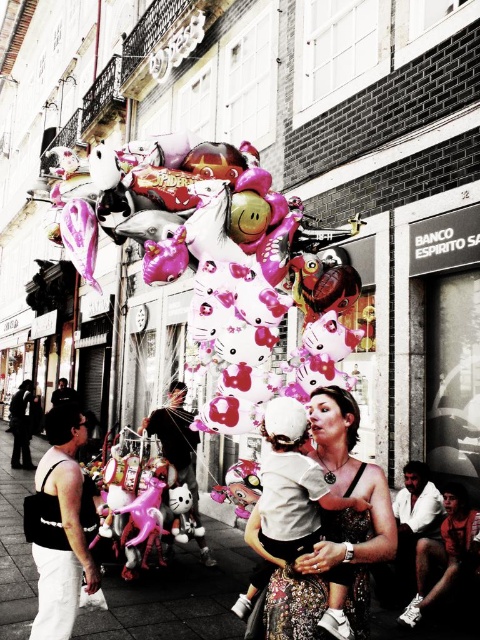
Question: Can you confirm if matte white dress at center is thinner than white shirt at lower right?

Choices:
 (A) yes
 (B) no

Answer: (B)

Question: Which point appears closest to the camera in this image?

Choices:
 (A) pos(223,394)
 (B) pos(408,579)
 (C) pos(40,612)

Answer: (C)

Question: Can you confirm if shiny pink balloon at center is positioned below white fabric bag at lower left?

Choices:
 (A) no
 (B) yes

Answer: (A)

Question: Which of these objects is positioned closest to the white shirt at lower right?

Choices:
 (A) white fabric bag at lower left
 (B) matte black shirt at center
 (C) shiny pink balloon at center
 (D) matte white dress at center

Answer: (D)

Question: Considering the relative positions of white shirt at lower right and matte black shirt at center in the image provided, where is white shirt at lower right located with respect to matte black shirt at center?

Choices:
 (A) above
 (B) below

Answer: (B)

Question: Which object appears farthest from the camera in this image?

Choices:
 (A) shiny pink balloon at center
 (B) white shirt at lower right
 (C) white fabric bag at lower left
 (D) matte black shirt at center

Answer: (D)